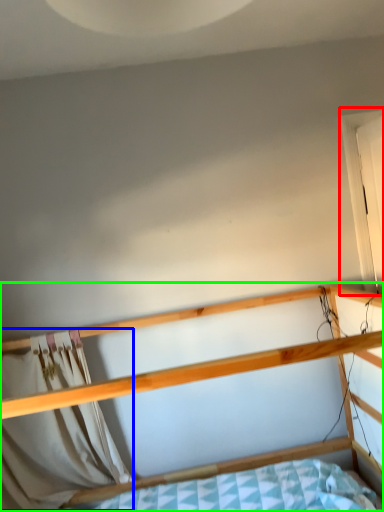
Question: Which object is positioned closest to window (highlighted by a red box)? Select from curtain (highlighted by a blue box) and bed (highlighted by a green box).

Choices:
 (A) curtain
 (B) bed

Answer: (B)